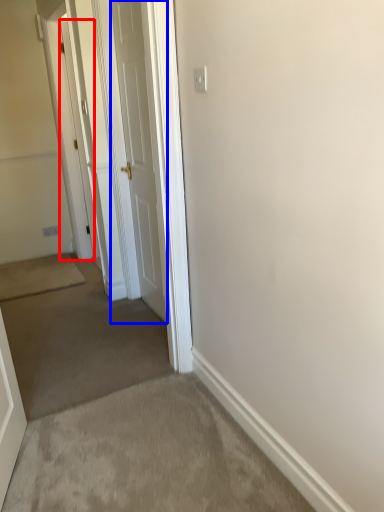
Question: Which object appears closest to the camera in this image, door (highlighted by a red box) or door (highlighted by a blue box)?

Choices:
 (A) door
 (B) door

Answer: (B)